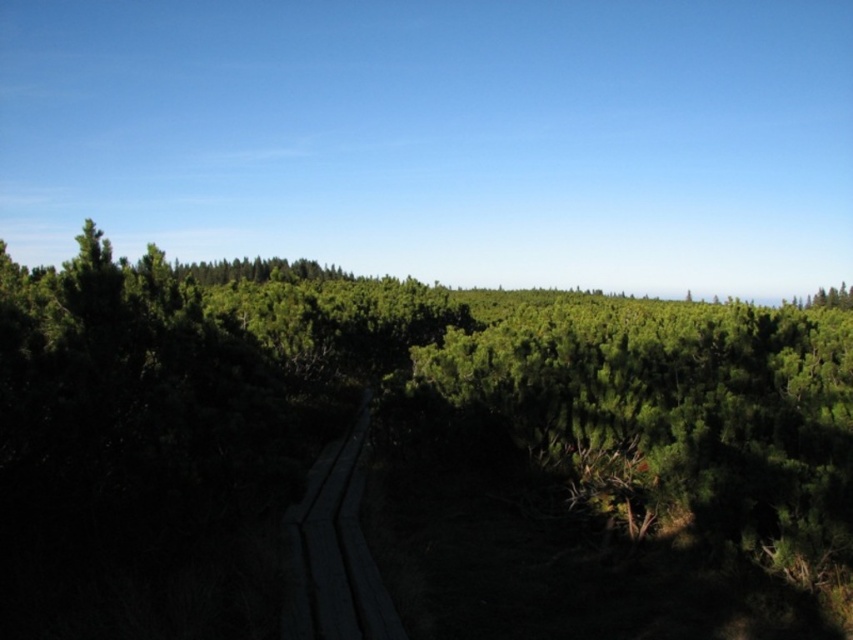
Question: Which point is closer to the camera?

Choices:
 (A) dark wood boardwalk at center
 (B) green textured forest at center

Answer: (B)

Question: In this image, where is green textured forest at center located relative to dark wood boardwalk at center?

Choices:
 (A) left
 (B) right

Answer: (B)

Question: Which of the following is the closest to the observer?

Choices:
 (A) dark wood boardwalk at center
 (B) green textured forest at center

Answer: (B)

Question: Is the position of green textured forest at center less distant than that of dark wood boardwalk at center?

Choices:
 (A) no
 (B) yes

Answer: (B)

Question: Among these objects, which one is nearest to the camera?

Choices:
 (A) dark wood boardwalk at center
 (B) green textured forest at center

Answer: (B)

Question: Is green textured forest at center to the right of dark wood boardwalk at center from the viewer's perspective?

Choices:
 (A) no
 (B) yes

Answer: (B)